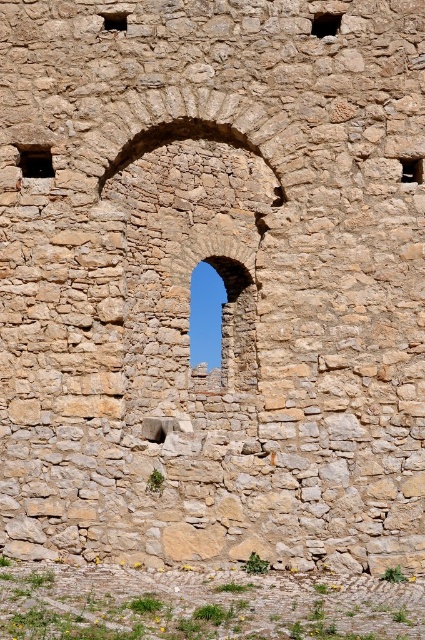
Can you confirm if brown stone window at upper left is positioned below matte stone window at upper right?

No.

Between point (34, 170) and point (402, 157), which one is positioned in front?

Point (402, 157) is more forward.

Which is in front, point (42, 154) or point (421, 164)?

Positioned in front is point (421, 164).

The image size is (425, 640). Identify the location of brown stone window at upper left. (34, 161).

Can you confirm if brown stone window at upper left is shorter than stone window at upper center?

No.

Consider the image. Can you confirm if brown stone window at upper left is positioned to the left of stone window at upper center?

Indeed, brown stone window at upper left is positioned on the left side of stone window at upper center.

Where is `brown stone window at upper left`? Image resolution: width=425 pixels, height=640 pixels. brown stone window at upper left is located at coordinates (34, 161).

Does stone window at upper center have a greater width compared to matte stone window at upper right?

Indeed, stone window at upper center has a greater width compared to matte stone window at upper right.

Which of these two, stone window at upper center or matte stone window at upper right, stands taller?

With more height is matte stone window at upper right.

Identify the location of stone window at upper center. This screenshot has height=640, width=425. (325, 24).